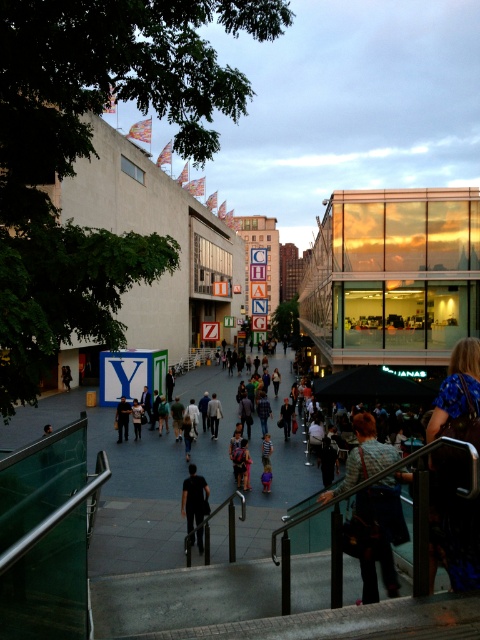
You are standing on the staircase and looking towards the beige concrete mall at center and the dark blue shirt at center. Which object is higher in elevation?

The beige concrete mall at center is taller than the dark blue shirt at center, so the beige concrete mall at center is higher in elevation.

You are a photographer standing at the top of the staircase and want to capture both the blue floral shirt at lower right and the denim jacket at center in your shot. Which clothing item will appear bigger in your photo?

The blue floral shirt at lower right will appear bigger in the photo because it is larger in size than the denim jacket at center.

You are standing at the top of the staircase in the urban scene. You notice two points marked in the image. Which point is closer to you, point 1 at coordinates (384, 563) or point 2 at coordinates (238, 449)?

Point 1 at coordinates (384, 563) is closer to you than point 2 at coordinates (238, 449).